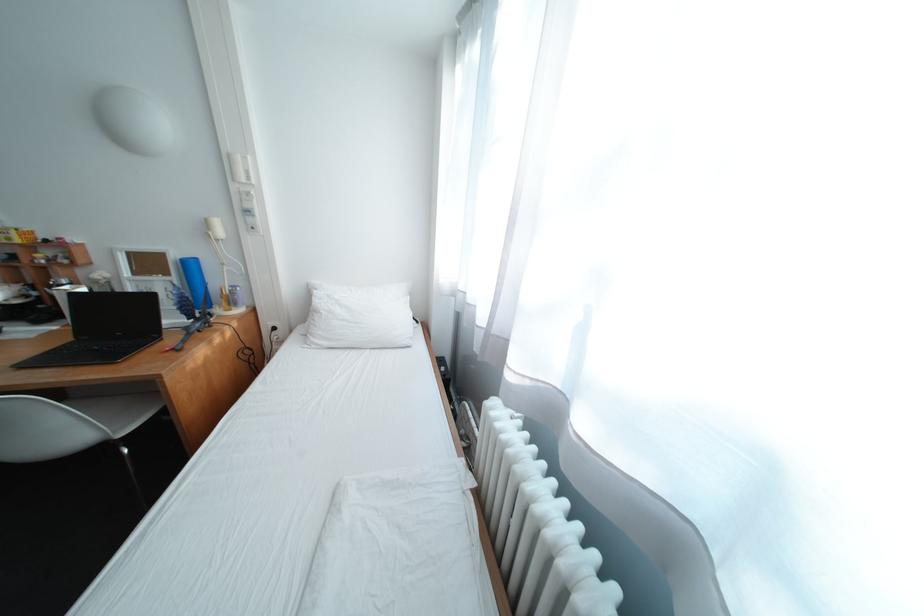
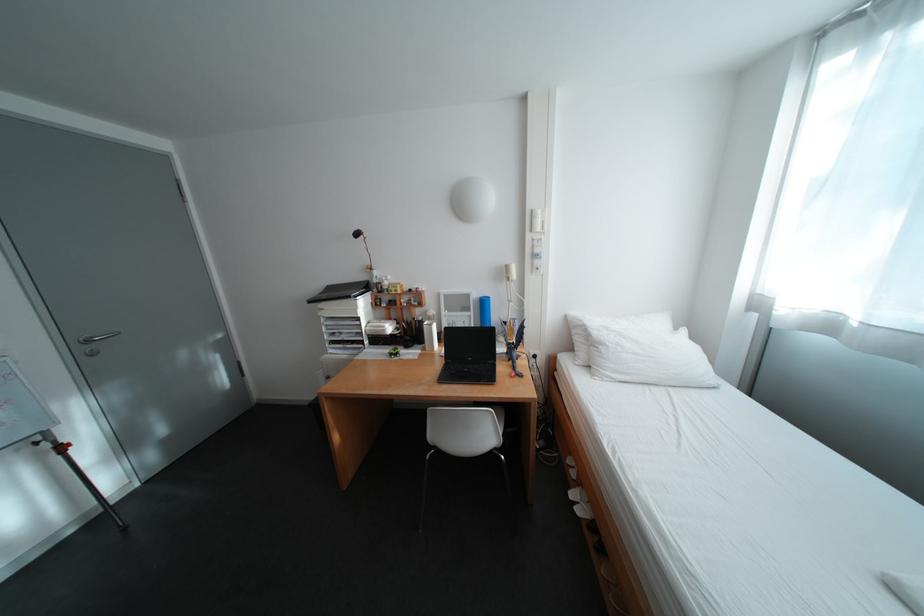
In the second image, find the point that corresponds to [330,314] in the first image.

(614, 346)